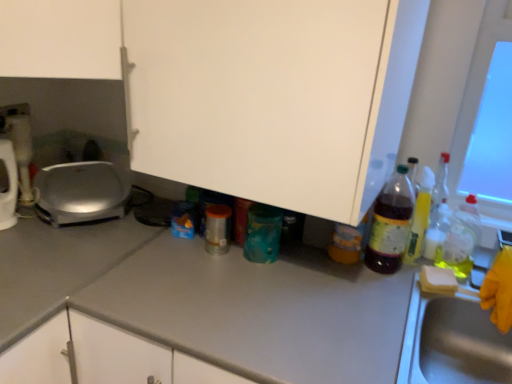
You are a GUI agent. You are given a task and a screenshot of the screen. Output one action in this format:
    pyautogui.click(x=<x>, y=<y>)
    Task: Click on the free area in between yellow sponge at right and teal matte canister at center, the 4th bottle in the right-to-left sequence
    
    Given the screenshot: What is the action you would take?
    pyautogui.click(x=333, y=269)